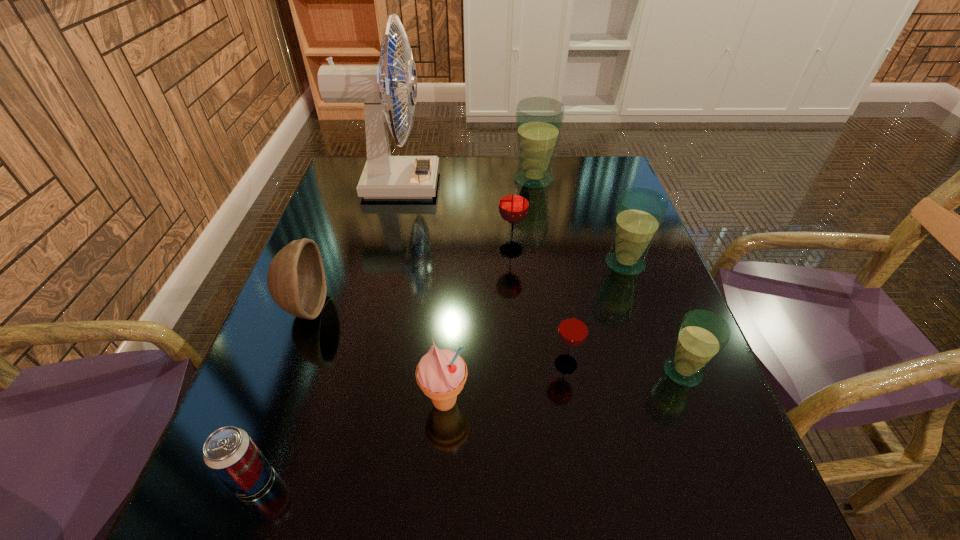
Where is `free spot between the fifth farthest object and the smallest blue glass`? free spot between the fifth farthest object and the smallest blue glass is located at coordinates (493, 339).

Find the location of a particular element. Image resolution: width=960 pixels, height=540 pixels. vacant point located between the farthest blue glass and the fifth farthest object is located at coordinates (420, 243).

This screenshot has height=540, width=960. I want to click on free spot between the fourth object from left to right and the farthest glass, so click(490, 291).

Locate an element on the screen. vacant region between the second farthest blue glass and the left red glass is located at coordinates (568, 257).

At what (x,y) coordinates should I click in order to perform the action: click on vacant area that lies between the bowl and the nearest object. Please return your answer as a coordinate pair (x, y). Looking at the image, I should click on (279, 393).

Find the location of a particular element. The image size is (960, 540). empty location between the farthest glass and the smaller red glass is located at coordinates (550, 272).

Find the location of a particular element. The width and height of the screenshot is (960, 540). object that stands as the closest to the tallest glass is located at coordinates coord(384,176).

Identify which object is located as the nearest to the second biggest blue glass. Please provide its 2D coordinates. Your answer should be formatted as a tuple, i.e. [(x, y)], where the tuple contains the x and y coordinates of a point satisfying the conditions above.

[(513, 206)]

Locate which glass is the fourth closest to the bigger red glass. Please provide its 2D coordinates. Your answer should be formatted as a tuple, i.e. [(x, y)], where the tuple contains the x and y coordinates of a point satisfying the conditions above.

[(702, 334)]

Locate which glass ranks third in proximity to the right red glass. Please provide its 2D coordinates. Your answer should be formatted as a tuple, i.e. [(x, y)], where the tuple contains the x and y coordinates of a point satisfying the conditions above.

[(513, 206)]